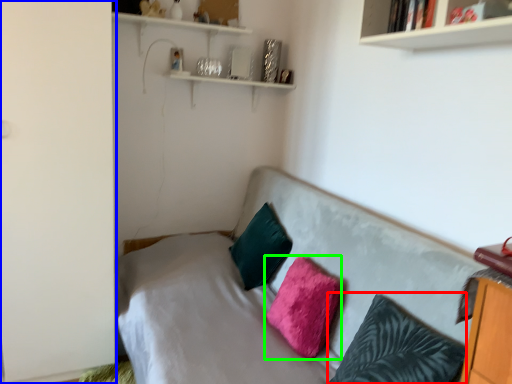
Question: Which object is the closest to the pillow (highlighted by a red box)? Choose among these: side (highlighted by a blue box) or pillow (highlighted by a green box).

Choices:
 (A) side
 (B) pillow

Answer: (B)